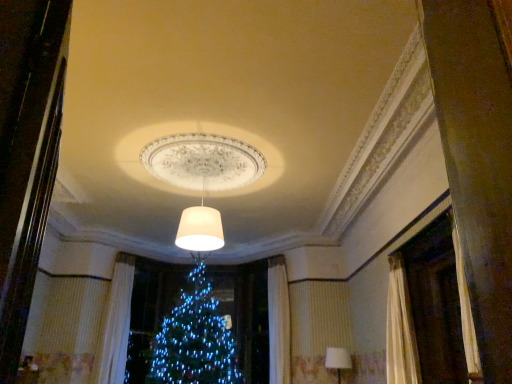
What do you see at coordinates (116, 323) in the screenshot? I see `white textured curtain at left` at bounding box center [116, 323].

Locate an element on the screen. The width and height of the screenshot is (512, 384). white fabric lampshade at lower right, positioned as the 2th lamp in top-to-bottom order is located at coordinates (338, 360).

This screenshot has width=512, height=384. What do you see at coordinates (200, 228) in the screenshot? I see `white matte lampshade at center, placed as the 1th lamp when sorted from front to back` at bounding box center [200, 228].

You are a GUI agent. You are given a task and a screenshot of the screen. Output one action in this format:
    pyautogui.click(x=<x>, y=<y>)
    Task: Click on the white textured curtain at left
    Image resolution: width=512 pixels, height=384 pixels.
    Given the screenshot: What is the action you would take?
    pyautogui.click(x=116, y=323)

From a real-world perspective, is white matte lampshade at center, the first lamp when ordered from left to right, over white textured curtain at left?

Indeed, from a real-world perspective, white matte lampshade at center, the first lamp when ordered from left to right, stands above white textured curtain at left.

Considering their positions, is white matte lampshade at center, the first lamp when ordered from left to right, located in front of or behind white textured curtain at left?

white matte lampshade at center, the first lamp when ordered from left to right, is in front of white textured curtain at left.

Is white matte lampshade at center, positioned as the second lamp in back-to-front order, bigger than white textured curtain at left?

No, white matte lampshade at center, positioned as the second lamp in back-to-front order, is not bigger than white textured curtain at left.

From the image's perspective, who appears lower, white matte lampshade at center, marked as the 2th lamp in a bottom-to-top arrangement, or white textured curtain at left?

white textured curtain at left, from the image's perspective.

Where is `lamp that is the 1st one when counting forward from the white textured curtain at left`? lamp that is the 1st one when counting forward from the white textured curtain at left is located at coordinates (338, 360).

Which is more to the right, white fabric lampshade at lower right, marked as the first lamp in a right-to-left arrangement, or white textured curtain at left?

From the viewer's perspective, white fabric lampshade at lower right, marked as the first lamp in a right-to-left arrangement, appears more on the right side.

Can we say white fabric lampshade at lower right, marked as the first lamp in a right-to-left arrangement, lies outside white textured curtain at left?

Yes, white fabric lampshade at lower right, marked as the first lamp in a right-to-left arrangement, is located beyond the bounds of white textured curtain at left.

This screenshot has height=384, width=512. Find the location of `curtain above the white fabric lampshade at lower right, positioned as the 2th lamp in top-to-bottom order (from a real-world perspective)`. curtain above the white fabric lampshade at lower right, positioned as the 2th lamp in top-to-bottom order (from a real-world perspective) is located at coordinates (116, 323).

Is white textured curtain at left taller or shorter than white fabric lampshade at lower right, positioned as the 2th lamp in top-to-bottom order?

white textured curtain at left is taller than white fabric lampshade at lower right, positioned as the 2th lamp in top-to-bottom order.

Would you say white textured curtain at left is outside white fabric lampshade at lower right, marked as the first lamp in a right-to-left arrangement?

Absolutely, white textured curtain at left is external to white fabric lampshade at lower right, marked as the first lamp in a right-to-left arrangement.

Is white matte lampshade at center, positioned as the 1th lamp in top-to-bottom order, at the left side of white fabric lampshade at lower right, marked as the 1th lamp in a bottom-to-top arrangement?

Yes.

Looking at this image, between white matte lampshade at center, placed as the 1th lamp when sorted from front to back, and white fabric lampshade at lower right, which appears as the first lamp when viewed from the back, which one has smaller width?

white fabric lampshade at lower right, which appears as the first lamp when viewed from the back, is thinner.

How distant is white matte lampshade at center, placed as the 1th lamp when sorted from front to back, from white fabric lampshade at lower right, which appears as the first lamp when viewed from the back?

3.00 meters.

Is white matte lampshade at center, positioned as the 1th lamp in top-to-bottom order, facing away from white fabric lampshade at lower right, the second lamp in the left-to-right sequence?

No, white matte lampshade at center, positioned as the 1th lamp in top-to-bottom order, is not facing the opposite direction of white fabric lampshade at lower right, the second lamp in the left-to-right sequence.

Which object is more forward, white fabric lampshade at lower right, which appears as the first lamp when viewed from the back, or white matte lampshade at center, placed as the 1th lamp when sorted from front to back?

white matte lampshade at center, placed as the 1th lamp when sorted from front to back.

In the scene shown: Which is farther, (349, 358) or (210, 223)?

The point (349, 358) is behind.

Is white fabric lampshade at lower right, positioned as the 2th lamp in top-to-bottom order, spatially inside white matte lampshade at center, positioned as the second lamp in back-to-front order, or outside of it?

white fabric lampshade at lower right, positioned as the 2th lamp in top-to-bottom order, is not inside white matte lampshade at center, positioned as the second lamp in back-to-front order, it's outside.

Consider the image. Is there a large distance between white fabric lampshade at lower right, marked as the 1th lamp in a bottom-to-top arrangement, and white matte lampshade at center, positioned as the second lamp in back-to-front order?

Indeed, white fabric lampshade at lower right, marked as the 1th lamp in a bottom-to-top arrangement, is not near white matte lampshade at center, positioned as the second lamp in back-to-front order.

Is white textured curtain at left positioned before white matte lampshade at center, marked as the 2th lamp in a bottom-to-top arrangement?

No, white textured curtain at left is behind white matte lampshade at center, marked as the 2th lamp in a bottom-to-top arrangement.

Between white textured curtain at left and white matte lampshade at center, the second lamp viewed from the right, which one has larger width?

With larger width is white matte lampshade at center, the second lamp viewed from the right.

Which object is positioned more to the left, white textured curtain at left or white matte lampshade at center, positioned as the 1th lamp in top-to-bottom order?

From the viewer's perspective, white textured curtain at left appears more on the left side.

Find the location of a particular element. Image resolution: width=512 pixels, height=384 pixels. curtain behind the white matte lampshade at center, placed as the 1th lamp when sorted from front to back is located at coordinates pos(116,323).

I want to click on lamp below the white textured curtain at left (from the image's perspective), so point(338,360).

Looking at this image, estimate the real-world distances between objects in this image. Which object is further from white fabric lampshade at lower right, marked as the first lamp in a right-to-left arrangement, white textured curtain at left or white matte lampshade at center, placed as the 1th lamp when sorted from front to back?

Among the two, white textured curtain at left is located further to white fabric lampshade at lower right, marked as the first lamp in a right-to-left arrangement.

Based on their spatial positions, is white matte lampshade at center, placed as the 1th lamp when sorted from front to back, or white textured curtain at left further from white fabric lampshade at lower right, which appears as the first lamp when viewed from the back?

Among the two, white textured curtain at left is located further to white fabric lampshade at lower right, which appears as the first lamp when viewed from the back.

Estimate the real-world distances between objects in this image. Which object is closer to white matte lampshade at center, positioned as the second lamp in back-to-front order, white fabric lampshade at lower right, which appears as the first lamp when viewed from the back, or white textured curtain at left?

white fabric lampshade at lower right, which appears as the first lamp when viewed from the back, lies closer to white matte lampshade at center, positioned as the second lamp in back-to-front order, than the other object.

Looking at the image, which one is located further to white textured curtain at left, white fabric lampshade at lower right, marked as the 1th lamp in a bottom-to-top arrangement, or white matte lampshade at center, the second lamp viewed from the right?

Based on the image, white fabric lampshade at lower right, marked as the 1th lamp in a bottom-to-top arrangement, appears to be further to white textured curtain at left.

Based on the photo, looking at the image, which one is located further to white matte lampshade at center, placed as the 1th lamp when sorted from front to back, white textured curtain at left or white fabric lampshade at lower right, positioned as the 2th lamp in top-to-bottom order?

Based on the image, white textured curtain at left appears to be further to white matte lampshade at center, placed as the 1th lamp when sorted from front to back.

From the image, which object appears to be farther from white textured curtain at left, white matte lampshade at center, placed as the 1th lamp when sorted from front to back, or white fabric lampshade at lower right, marked as the 1th lamp in a bottom-to-top arrangement?

The object further to white textured curtain at left is white fabric lampshade at lower right, marked as the 1th lamp in a bottom-to-top arrangement.

Where is `lamp between white textured curtain at left and white fabric lampshade at lower right, marked as the 1th lamp in a bottom-to-top arrangement, from left to right`? This screenshot has height=384, width=512. lamp between white textured curtain at left and white fabric lampshade at lower right, marked as the 1th lamp in a bottom-to-top arrangement, from left to right is located at coordinates (200, 228).